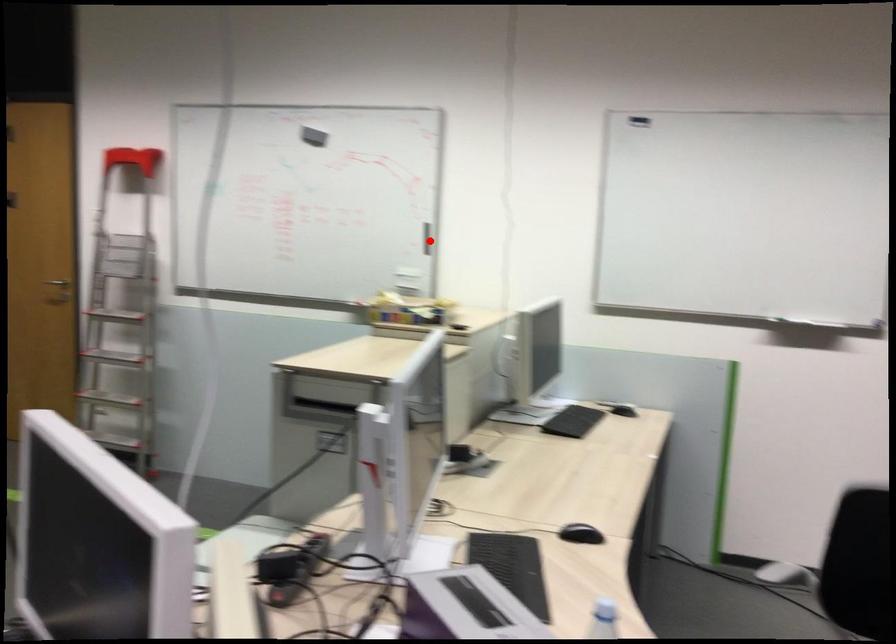
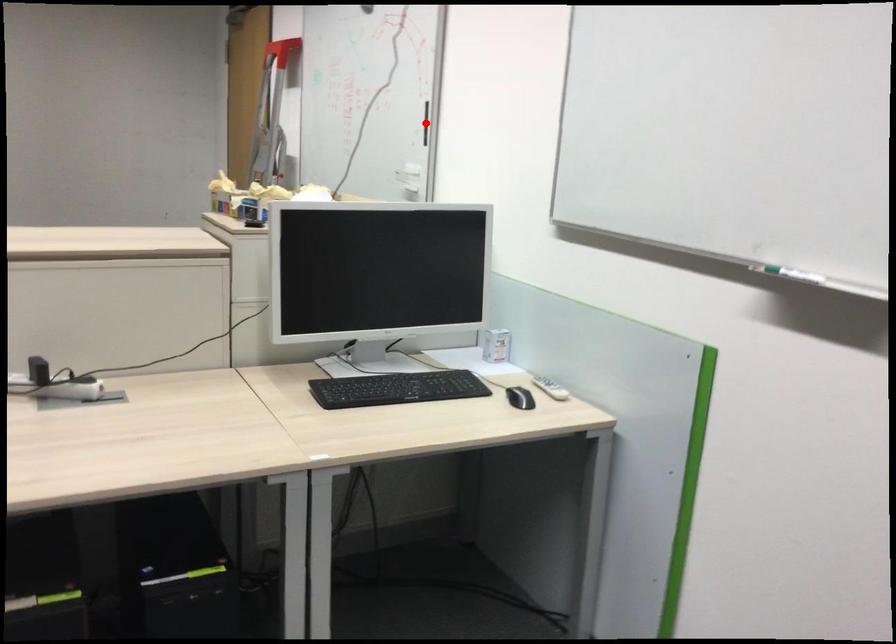
I am providing you with two images of the same scene from different viewpoints. A red point is marked on the first image and another point is marked on the second image. Does the point marked in image1 correspond to the same location as the one in image2?

Yes